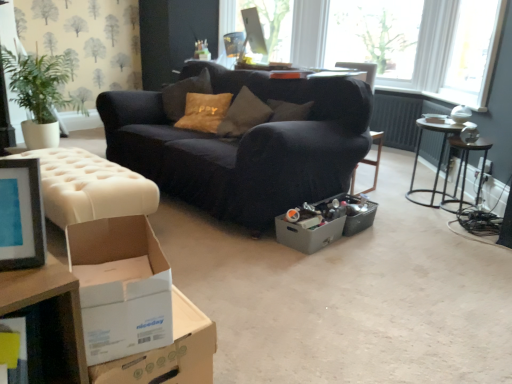
Question: From a real-world perspective, is white cardboard box at lower left, positioned as the 3th cardboard box in back-to-front order, above or below metallic dark brown side table at right?

Choices:
 (A) below
 (B) above

Answer: (B)

Question: Is white cardboard box at lower left, positioned as the 3th cardboard box in back-to-front order, bigger or smaller than metallic dark brown side table at right?

Choices:
 (A) small
 (B) big

Answer: (A)

Question: Which object is the farthest from the white cardboard box at lower left, which is the second cardboard box in right-to-left order?

Choices:
 (A) metallic silver table at right, acting as the 1th table starting from the right
 (B) velvet dark blue couch at center
 (C) white tufted ottoman at left
 (D) metallic dark brown side table at right
 (E) gray cardboard box at center, which appears as the third cardboard box when viewed from the front

Answer: (D)

Question: Which of these objects is positioned farthest from the velvet dark blue couch at center?

Choices:
 (A) transparent glass window at upper right
 (B) white cardboard box at lower left, which is the first cardboard box in left-to-right order
 (C) metallic dark brown side table at right
 (D) matte black picture frame at left
 (E) gray cardboard box at center, which is the 1th cardboard box from back to front

Answer: (A)